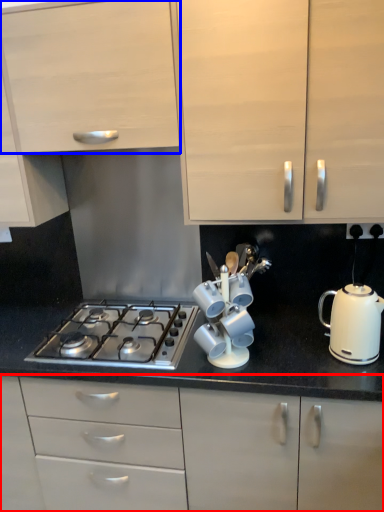
Question: Which object appears closest to the camera in this image, cabinetry (highlighted by a red box) or cabinetry (highlighted by a blue box)?

Choices:
 (A) cabinetry
 (B) cabinetry

Answer: (B)